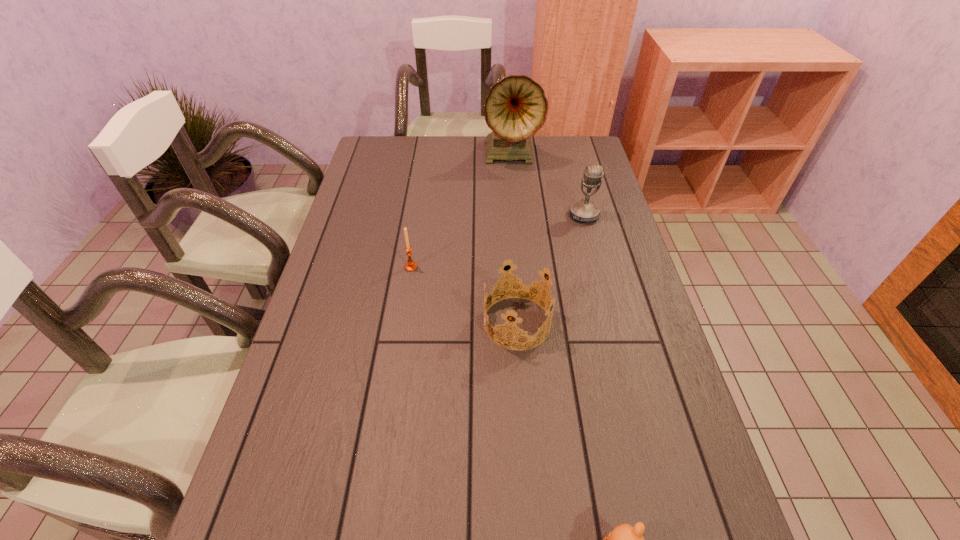
The width and height of the screenshot is (960, 540). What are the coordinates of `free space located on the left of the fourth farthest object` in the screenshot? It's located at (400, 323).

The image size is (960, 540). In order to click on object situated at the far edge in this screenshot , I will do `click(515, 108)`.

Identify the location of object present at the right edge. (582, 211).

In the image, there is a desktop. Where is `blank space at the far edge`? Image resolution: width=960 pixels, height=540 pixels. blank space at the far edge is located at coordinates point(550,147).

This screenshot has width=960, height=540. Identify the location of free space at the left edge. (357, 289).

Find the location of a particular element. vacant space at the right edge is located at coordinates (594, 276).

The image size is (960, 540). What are the coordinates of `vacant space at the far left corner` in the screenshot? It's located at (406, 142).

Where is `free space at the far right corner of the desktop`? The image size is (960, 540). free space at the far right corner of the desktop is located at coordinates (579, 138).

The image size is (960, 540). What are the coordinates of `free spot between the candle_holder and the farthest object` in the screenshot? It's located at (461, 211).

Identify the location of unoccupied position between the tallest object and the leftmost object. This screenshot has height=540, width=960. (461, 211).